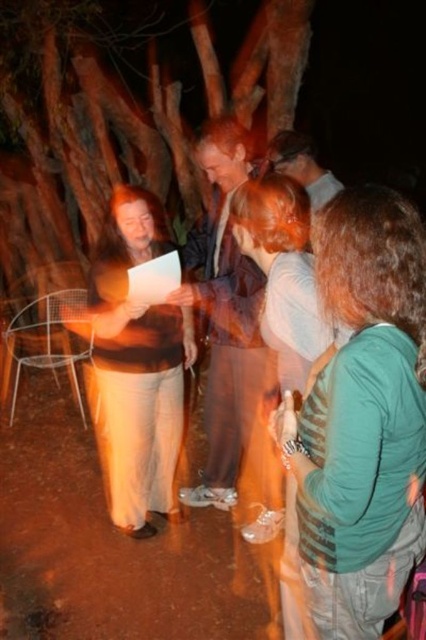
You are standing at the center of the image and want to hand a document to the person wearing the light brown leather jacket at center. In which direction should you move to reach them?

The light brown leather jacket at center is already at the center of the image, so you don not need to move in any specific direction to reach them.

You are organizing a night event in a rustic area and need to arrange seating. There are two shirts visible in the image, a brown matte shirt at center and a matte brown shirt at upper center. Which shirt would require a larger seat size based on the description?

The brown matte shirt at center requires a larger seat size because it is bigger than the matte brown shirt at upper center according to the description.